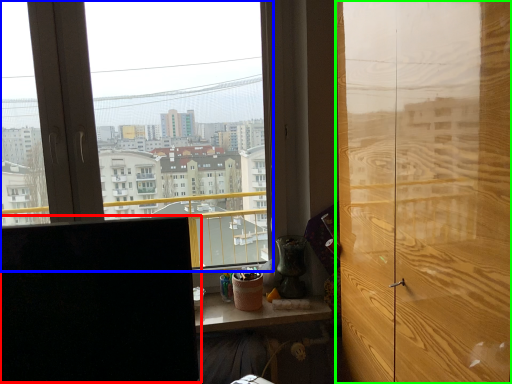
Question: Considering the real-world distances, which object is farthest from computer monitor (highlighted by a red box)? window (highlighted by a blue box) or door (highlighted by a green box)?

Choices:
 (A) window
 (B) door

Answer: (A)